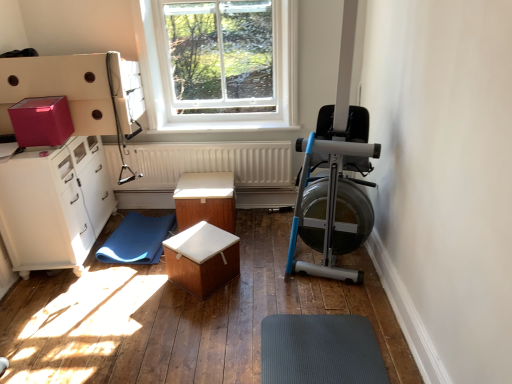
You are a GUI agent. You are given a task and a screenshot of the screen. Output one action in this format:
    pyautogui.click(x=<x>, y=<y>)
    Task: Click on the free location above wooden box at center, the second table when ordered from front to back (from a real-world perspective)
    The image size is (512, 384).
    Given the screenshot: What is the action you would take?
    pyautogui.click(x=202, y=185)